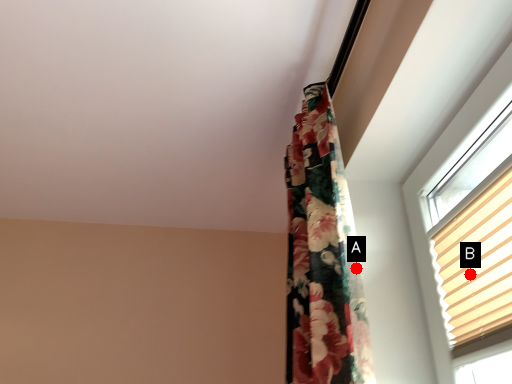
Question: Two points are circled on the image, labeled by A and B beside each circle. Which point is farther from the camera taking this photo?

Choices:
 (A) A is further
 (B) B is further

Answer: (B)